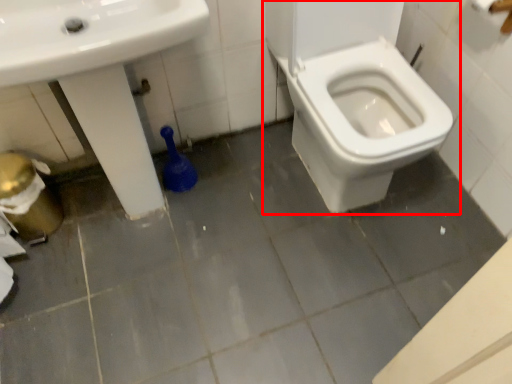
Question: Where is toilet (annotated by the red box) located in relation to sink in the image?

Choices:
 (A) left
 (B) right

Answer: (B)